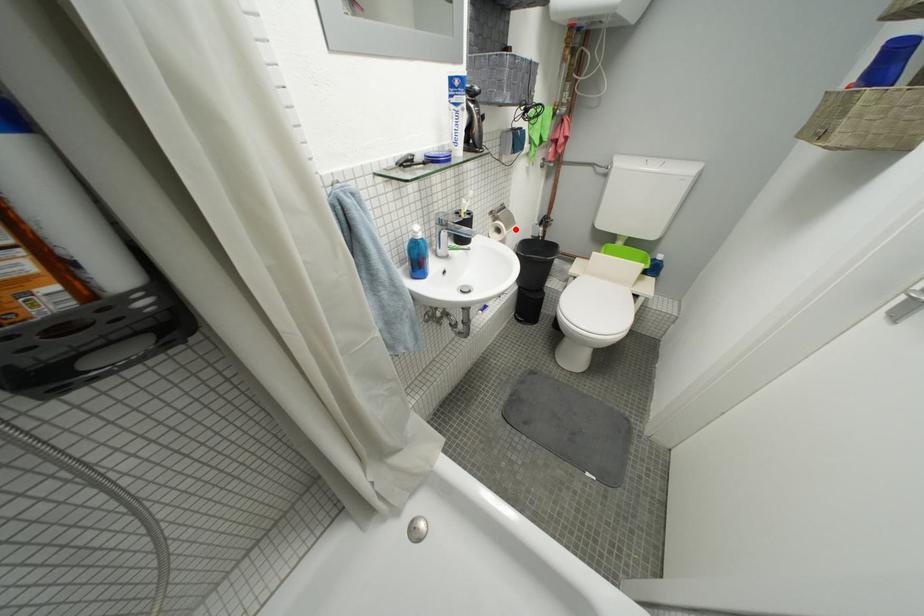
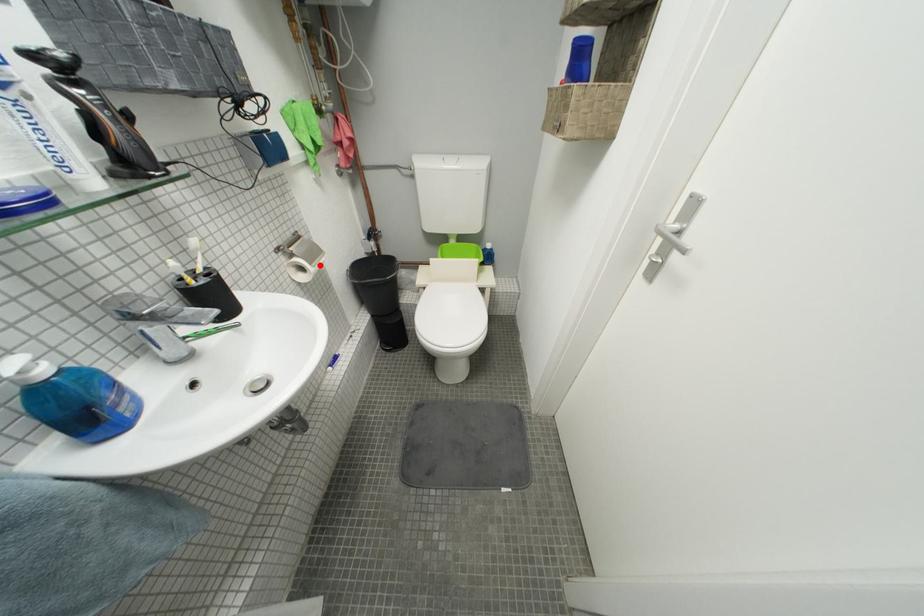
I am providing you with two images of the same scene from different viewpoints. A red point is marked on the first image and another point is marked on the second image. Is the red point in image1 aligned with the point shown in image2?

Yes